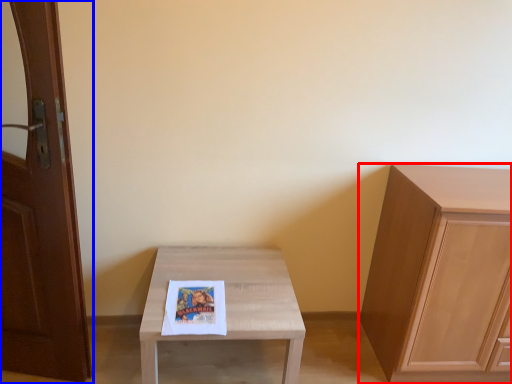
Question: Which object appears closest to the camera in this image, cabinetry (highlighted by a red box) or door (highlighted by a blue box)?

Choices:
 (A) cabinetry
 (B) door

Answer: (B)